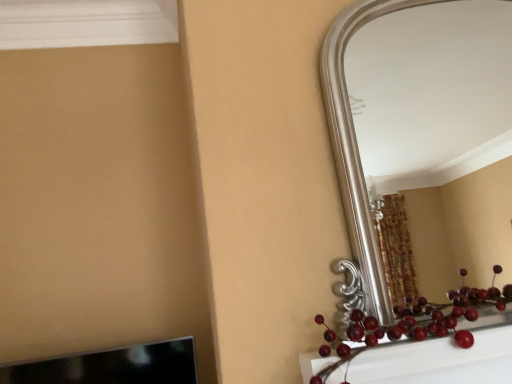
What is the approximate width of silver metallic mirror at upper right?

The width of silver metallic mirror at upper right is 2.82 inches.

The width and height of the screenshot is (512, 384). Find the location of `silver metallic mirror at upper right`. silver metallic mirror at upper right is located at coordinates (431, 93).

Describe the element at coordinates (431, 93) in the screenshot. This screenshot has width=512, height=384. I see `silver metallic mirror at upper right` at that location.

Measure the distance between glossy red berries at lower right and camera.

32.76 inches.

Locate an element on the screen. Image resolution: width=512 pixels, height=384 pixels. glossy red berries at lower right is located at coordinates (420, 336).

What do you see at coordinates (420, 336) in the screenshot?
I see `glossy red berries at lower right` at bounding box center [420, 336].

Measure the distance between point (444,339) and camera.

They are 35.55 inches apart.

Locate an element on the screen. silver metallic mirror at upper right is located at coordinates (431, 93).

Considering the positions of objects glossy red berries at lower right and silver metallic mirror at upper right in the image provided, who is more to the right, glossy red berries at lower right or silver metallic mirror at upper right?

From the viewer's perspective, silver metallic mirror at upper right appears more on the right side.

Does glossy red berries at lower right come behind silver metallic mirror at upper right?

No, it is not.

Does point (436, 311) lie in front of point (483, 161)?

That is True.

Looking at this image, from the image's perspective, relative to silver metallic mirror at upper right, is glossy red berries at lower right above or below?

From the image's perspective, glossy red berries at lower right appears below silver metallic mirror at upper right.

From a real-world perspective, which is physically above, glossy red berries at lower right or silver metallic mirror at upper right?

silver metallic mirror at upper right is physically above.

Looking at their sizes, would you say glossy red berries at lower right is wider or thinner than silver metallic mirror at upper right?

glossy red berries at lower right is wider than silver metallic mirror at upper right.

Considering the relative sizes of glossy red berries at lower right and silver metallic mirror at upper right in the image provided, is glossy red berries at lower right taller than silver metallic mirror at upper right?

Incorrect, the height of glossy red berries at lower right is not larger of that of silver metallic mirror at upper right.

Based on their sizes in the image, would you say glossy red berries at lower right is bigger or smaller than silver metallic mirror at upper right?

Clearly, glossy red berries at lower right is smaller in size than silver metallic mirror at upper right.

In the scene shown: Is glossy red berries at lower right positioned beyond the bounds of silver metallic mirror at upper right?

That's correct, glossy red berries at lower right is outside of silver metallic mirror at upper right.

Is glossy red berries at lower right beside silver metallic mirror at upper right?

No, glossy red berries at lower right is not beside silver metallic mirror at upper right.

Is glossy red berries at lower right positioned with its back to silver metallic mirror at upper right?

No, glossy red berries at lower right is not facing away from silver metallic mirror at upper right.

What's the angular difference between glossy red berries at lower right and silver metallic mirror at upper right's facing directions?

2.5 degrees.

Measure the distance from glossy red berries at lower right to silver metallic mirror at upper right.

The distance of glossy red berries at lower right from silver metallic mirror at upper right is 2.01 meters.

I want to click on fruit directly beneath the silver metallic mirror at upper right (from a real-world perspective), so click(x=420, y=336).

Is silver metallic mirror at upper right at the right side of glossy red berries at lower right?

Correct, you'll find silver metallic mirror at upper right to the right of glossy red berries at lower right.

Considering the positions of objects silver metallic mirror at upper right and glossy red berries at lower right in the image provided, who is in front, silver metallic mirror at upper right or glossy red berries at lower right?

glossy red berries at lower right.

Which is closer to the camera, (463, 132) or (350, 376)?

Point (463, 132).

From the image's perspective, between silver metallic mirror at upper right and glossy red berries at lower right, which one is located above?

silver metallic mirror at upper right appears higher in the image.

From a real-world perspective, which object stands above the other?

silver metallic mirror at upper right.

Can you confirm if silver metallic mirror at upper right is thinner than glossy red berries at lower right?

Indeed, silver metallic mirror at upper right has a lesser width compared to glossy red berries at lower right.

Based on the photo, considering the sizes of objects silver metallic mirror at upper right and glossy red berries at lower right in the image provided, who is shorter, silver metallic mirror at upper right or glossy red berries at lower right?

glossy red berries at lower right.

Is silver metallic mirror at upper right smaller than glossy red berries at lower right?

Incorrect, silver metallic mirror at upper right is not smaller in size than glossy red berries at lower right.

Choose the correct answer: Is silver metallic mirror at upper right inside glossy red berries at lower right or outside it?

silver metallic mirror at upper right cannot be found inside glossy red berries at lower right.

Would you say silver metallic mirror at upper right is a long distance from glossy red berries at lower right?

Absolutely, silver metallic mirror at upper right is distant from glossy red berries at lower right.

Could you tell me if silver metallic mirror at upper right is facing glossy red berries at lower right?

No, silver metallic mirror at upper right is not aimed at glossy red berries at lower right.

How different are the orientations of silver metallic mirror at upper right and glossy red berries at lower right in degrees?

2.5 degrees separate the facing orientations of silver metallic mirror at upper right and glossy red berries at lower right.

You are a GUI agent. You are given a task and a screenshot of the screen. Output one action in this format:
    pyautogui.click(x=<x>, y=<y>)
    Task: Click on the fruit on the left of silver metallic mirror at upper right
    
    Given the screenshot: What is the action you would take?
    pyautogui.click(x=420, y=336)

The width and height of the screenshot is (512, 384). I want to click on mirror above the glossy red berries at lower right (from the image's perspective), so click(431, 93).

Identify the location of fruit that is under the silver metallic mirror at upper right (from a real-world perspective). The width and height of the screenshot is (512, 384). (420, 336).